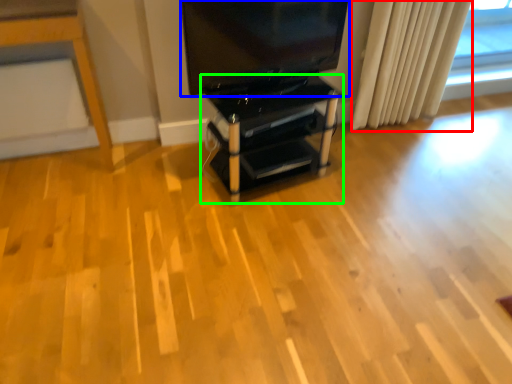
Question: Which is nearer to the curtain (highlighted by a red box)? television (highlighted by a blue box) or furniture (highlighted by a green box).

Choices:
 (A) television
 (B) furniture

Answer: (A)